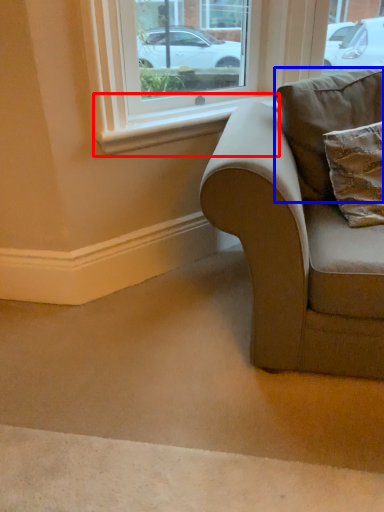
Question: Which object is further to the camera taking this photo, window sill (highlighted by a red box) or pillow (highlighted by a blue box)?

Choices:
 (A) window sill
 (B) pillow

Answer: (A)